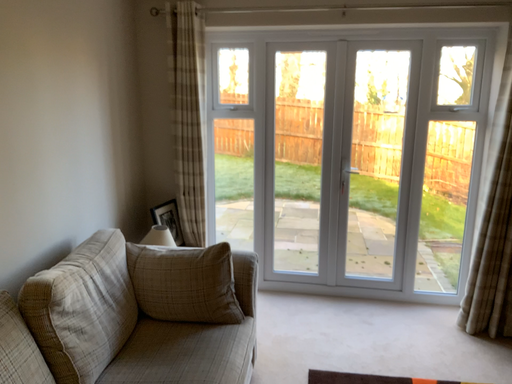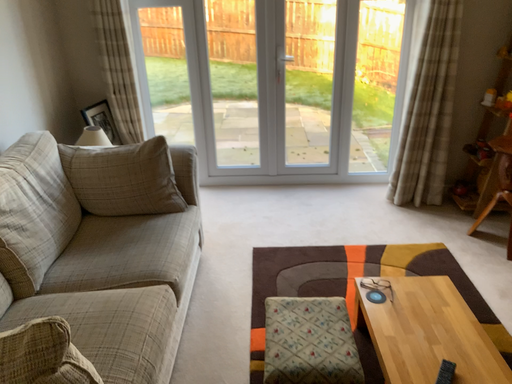
Question: How did the camera likely rotate when shooting the video?

Choices:
 (A) rotated right
 (B) rotated left

Answer: (A)